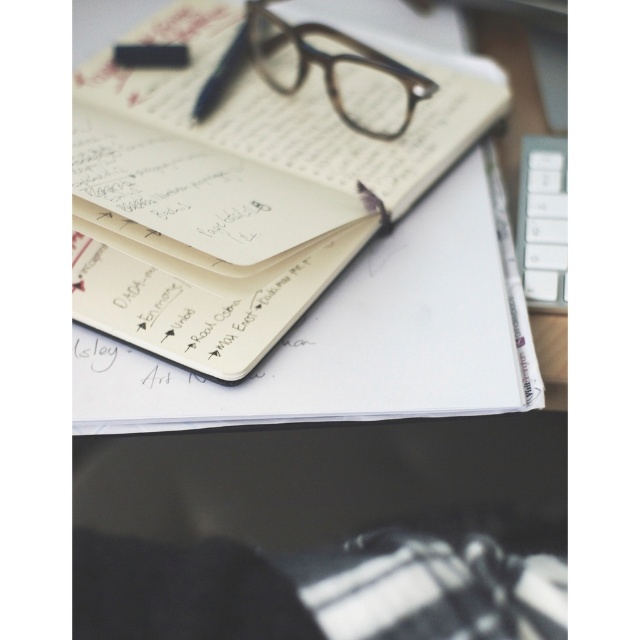
Who is lower down, matte paper notebook at center or brown tortoiseshell glasses at upper center?

matte paper notebook at center is lower down.

Is matte paper notebook at center smaller than brown tortoiseshell glasses at upper center?

No, matte paper notebook at center is not smaller than brown tortoiseshell glasses at upper center.

Where is `matte paper notebook at center`? The width and height of the screenshot is (640, 640). matte paper notebook at center is located at coordinates (236, 196).

Identify the location of matte paper notebook at center. (236, 196).

Which is behind, point (234, 291) or point (563, 288)?

The point (563, 288) is more distant.

Can you confirm if matte paper notebook at center is bigger than white plastic keyboard at upper right?

Correct, matte paper notebook at center is larger in size than white plastic keyboard at upper right.

This screenshot has width=640, height=640. What do you see at coordinates (236, 196) in the screenshot? I see `matte paper notebook at center` at bounding box center [236, 196].

At what (x,y) coordinates should I click in order to perform the action: click on matte paper notebook at center. Please return your answer as a coordinate pair (x, y). The width and height of the screenshot is (640, 640). Looking at the image, I should click on (236, 196).

Which is in front, point (340, 33) or point (561, 147)?

Point (561, 147) is in front.

Who is positioned more to the left, brown tortoiseshell glasses at upper center or white plastic keyboard at upper right?

brown tortoiseshell glasses at upper center

Identify the location of brown tortoiseshell glasses at upper center. This screenshot has width=640, height=640. (x=337, y=72).